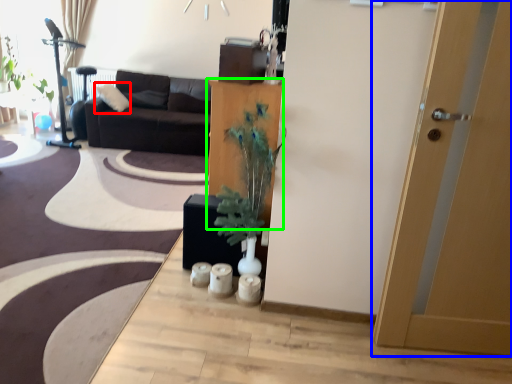
Question: Based on their relative distances, which object is nearer to pillow (highlighted by a red box)? Choose from door (highlighted by a blue box) and cabinetry (highlighted by a green box).

Choices:
 (A) door
 (B) cabinetry

Answer: (B)